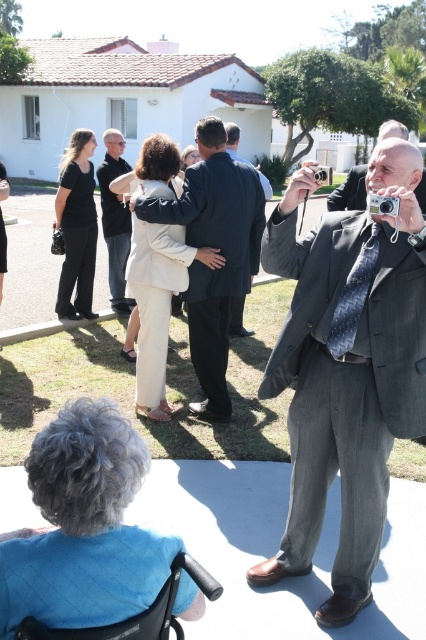
Can you confirm if dark gray suit at center is thinner than silver metallic camera at upper right?

Yes, dark gray suit at center is thinner than silver metallic camera at upper right.

Who is positioned more to the right, dark gray suit at center or silver metallic camera at upper right?

silver metallic camera at upper right

The image size is (426, 640). Describe the element at coordinates (241, 157) in the screenshot. I see `dark gray suit at center` at that location.

In order to click on dark gray suit at center in this screenshot , I will do `click(241, 157)`.

Does blue fabric wheelchair at lower left have a smaller size compared to gray suit at right?

Yes.

Who is lower down, blue fabric wheelchair at lower left or gray suit at right?

Positioned lower is blue fabric wheelchair at lower left.

You are a GUI agent. You are given a task and a screenshot of the screen. Output one action in this format:
    pyautogui.click(x=<x>, y=<y>)
    Task: Click on the blue fabric wheelchair at lower left
    
    Given the screenshot: What is the action you would take?
    pyautogui.click(x=83, y=525)

Who is higher up, gray suit at center or blue fabric wheelchair at lower left?

Positioned higher is gray suit at center.

Is gray suit at center shorter than blue fabric wheelchair at lower left?

Incorrect, gray suit at center's height does not fall short of blue fabric wheelchair at lower left's.

The height and width of the screenshot is (640, 426). I want to click on gray suit at center, so click(x=347, y=369).